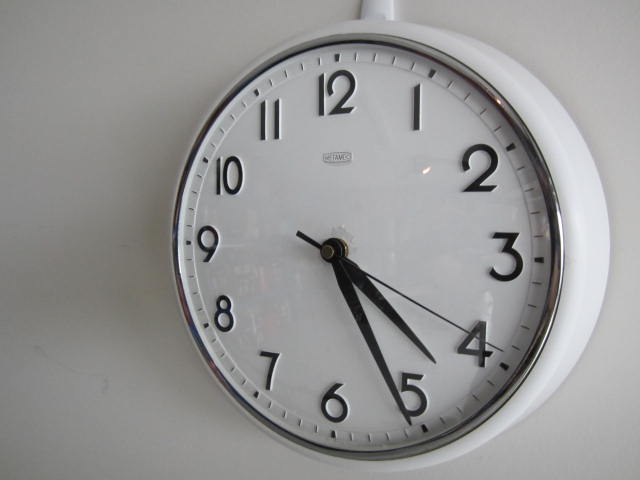
This screenshot has height=480, width=640. Identify the location of wall clock. (416, 252).